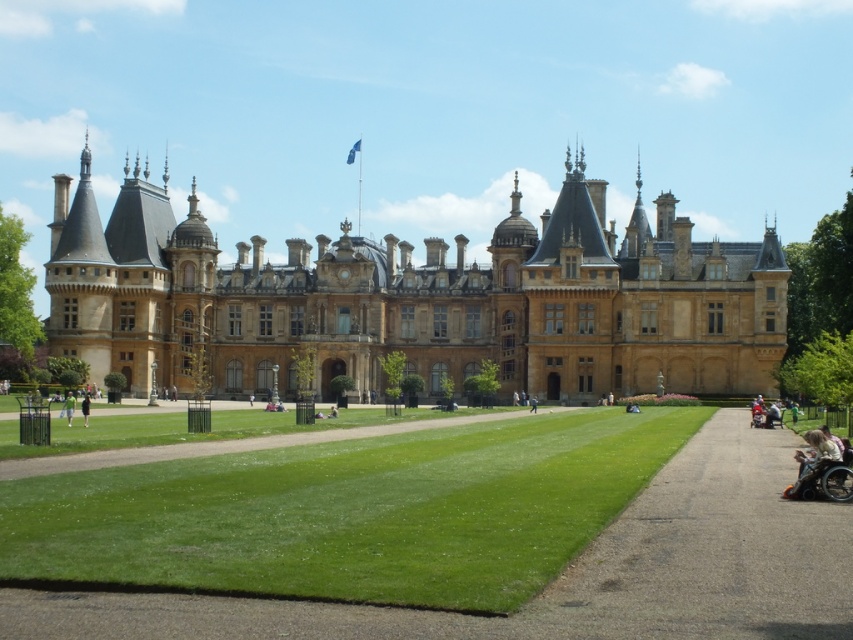
You are standing on the lawn in front of the historic building and see the smooth asphalt path at lower right and the dark brown leather jacket at center. Which object is closer to you?

The smooth asphalt path at lower right is closer to you because it is positioned below the dark brown leather jacket at center, indicating it is nearer in the scene.